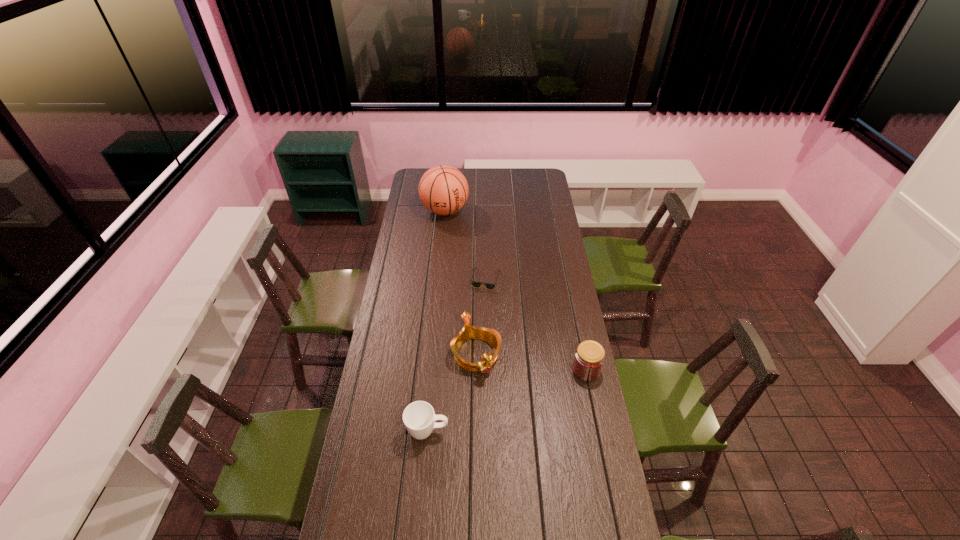
Locate an element on the screen. free space on the desktop that is between the cup and the rightmost object and is positioned on the lenses of the sunglasses is located at coordinates (534, 390).

This screenshot has height=540, width=960. What are the coordinates of `free spot on the desktop that is between the nearest object and the jam and is positioned on the surface of the basketball near the brand logo` in the screenshot? It's located at (527, 393).

Locate an element on the screen. The height and width of the screenshot is (540, 960). vacant spot on the desktop that is between the nearest object and the rightmost object and is positioned at the front emblem of the tiara is located at coordinates (499, 403).